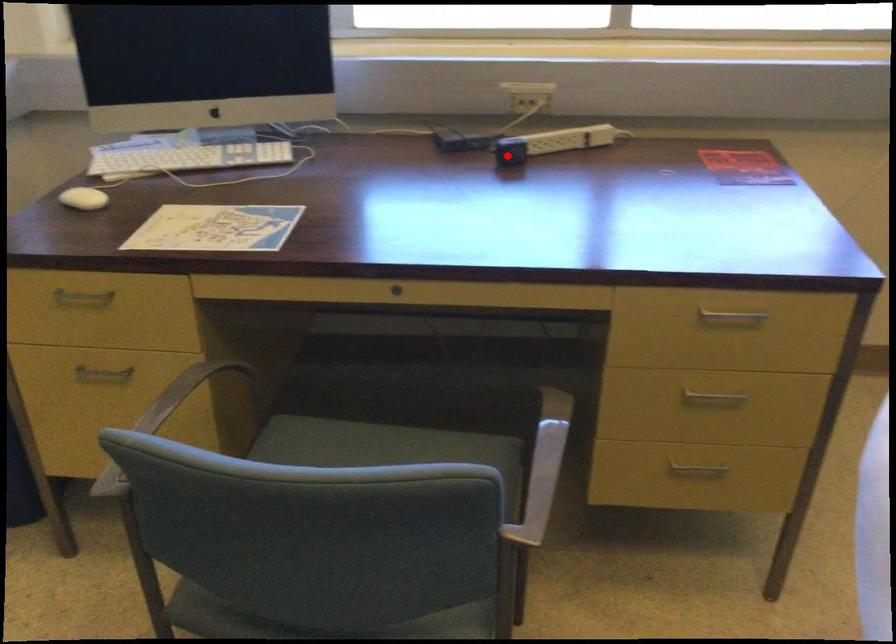
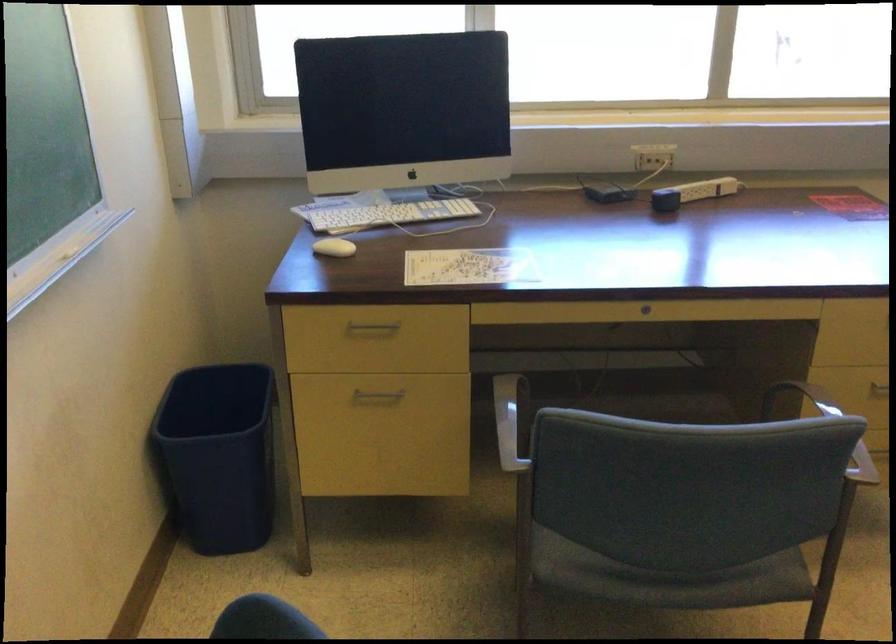
Where in the second image is the point corresponding to the highlighted location from the first image?

(665, 200)